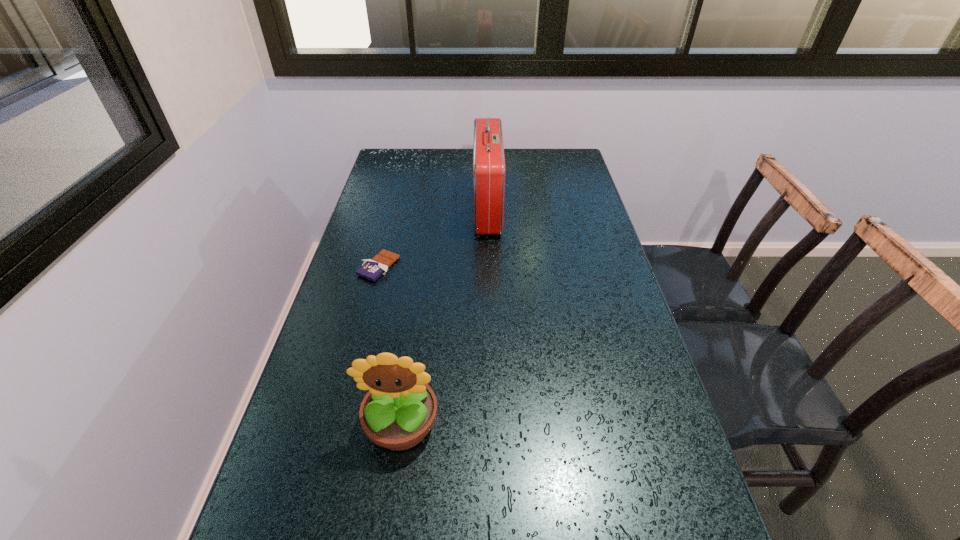
Identify the location of sunflower located in the left edge section of the desktop. (400, 409).

You are a GUI agent. You are given a task and a screenshot of the screen. Output one action in this format:
    pyautogui.click(x=<x>, y=<y>)
    Task: Click on the chocolate bar that is at the left edge
    
    Given the screenshot: What is the action you would take?
    pyautogui.click(x=372, y=269)

Where is `blank area at the far edge`? The image size is (960, 540). blank area at the far edge is located at coordinates (432, 154).

This screenshot has width=960, height=540. What are the coordinates of `free region at the left edge of the desktop` in the screenshot? It's located at (314, 366).

In the image, there is a desktop. At what (x,y) coordinates should I click in order to perform the action: click on free space at the right edge. Please return your answer as a coordinate pair (x, y). Looking at the image, I should click on (579, 268).

I want to click on vacant space at the far right corner, so click(552, 174).

In order to click on vacant area between the nearest object and the chocolate bar in this screenshot , I will do `click(390, 346)`.

Image resolution: width=960 pixels, height=540 pixels. I want to click on free space between the first-aid kit and the sunflower, so click(444, 316).

This screenshot has height=540, width=960. I want to click on unoccupied position between the nearest object and the second farthest object, so click(390, 346).

Identify the location of free space between the shortest object and the second tallest object. (390, 346).